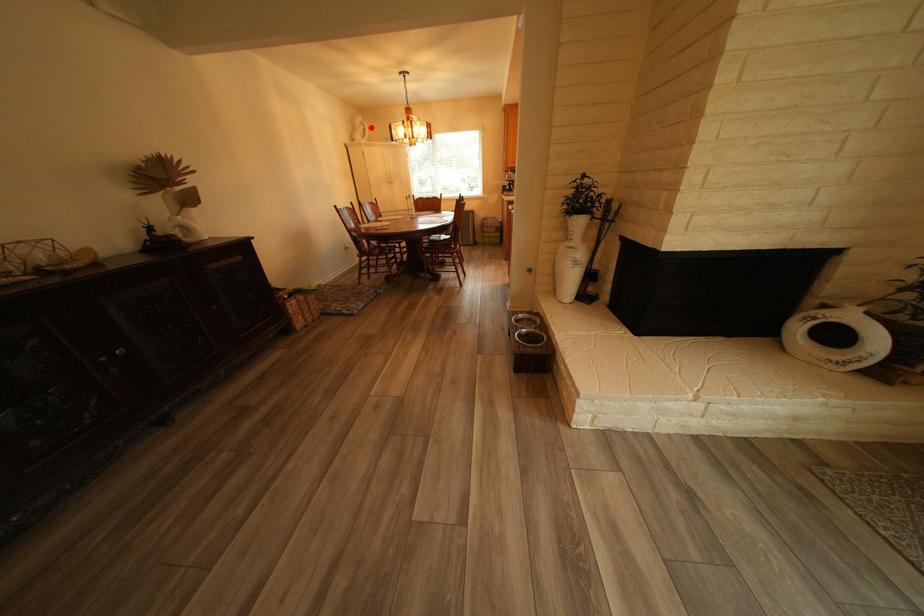
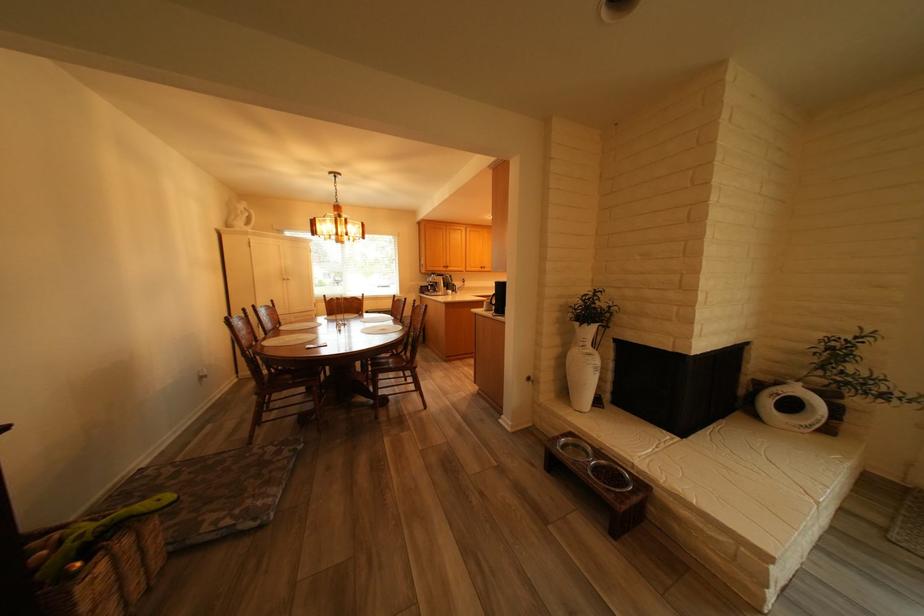
Question: I am providing you with two images of the same scene from different viewpoints. A red point is marked on the first image. At the location where the point appears in image 1, is it still visible in image 2?

Choices:
 (A) Yes
 (B) No

Answer: (A)